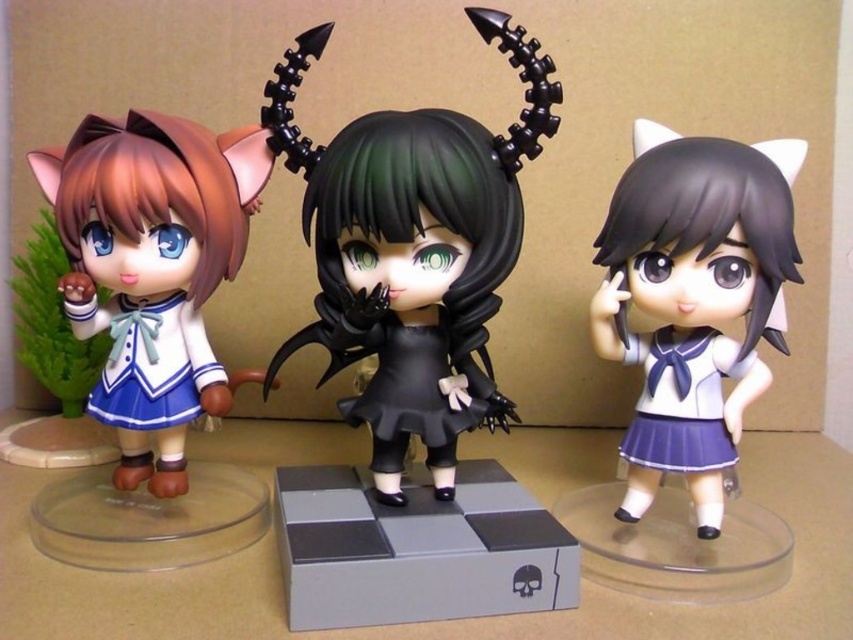
Question: Is satin purple skirt at center wider than matte blue fabric dress at left?

Choices:
 (A) yes
 (B) no

Answer: (B)

Question: Is matte blue fabric dress at left to the left of black matte school uniform at center from the viewer's perspective?

Choices:
 (A) yes
 (B) no

Answer: (A)

Question: Which is nearer to the satin blue school uniform at left?

Choices:
 (A) black matte doll at center
 (B) matte blue fabric dress at left
 (C) black matte school uniform at center
 (D) satin purple skirt at center

Answer: (B)

Question: Which object is farther from the camera taking this photo?

Choices:
 (A) matte blue fabric dress at left
 (B) black matte school uniform at center

Answer: (B)

Question: Which object is farther from the camera taking this photo?

Choices:
 (A) satin blue school uniform at left
 (B) satin blue skirt at center
 (C) black matte doll at center

Answer: (A)

Question: Where is black matte doll at center located in relation to black matte school uniform at center in the image?

Choices:
 (A) above
 (B) below

Answer: (A)